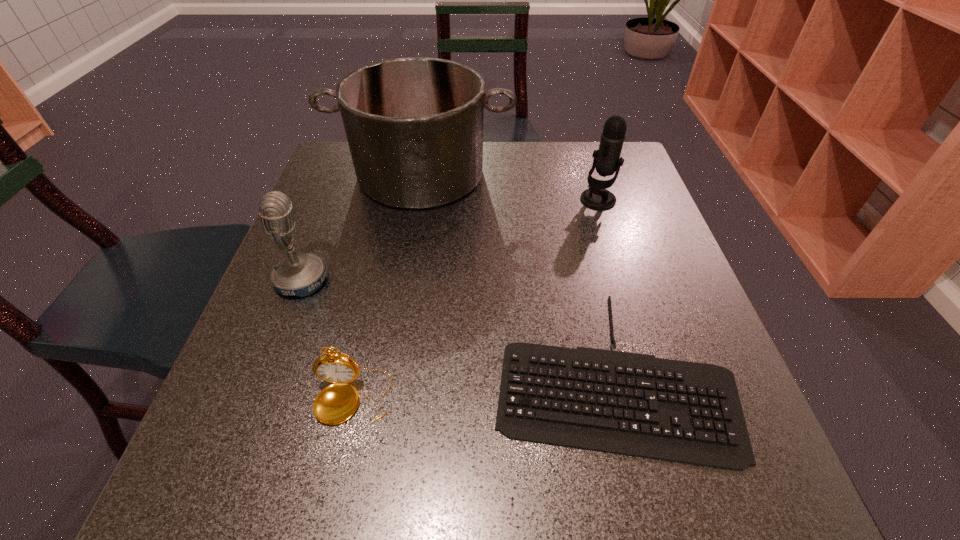
Where is `pan`? The width and height of the screenshot is (960, 540). pan is located at coordinates (414, 126).

In order to click on the farther microphone in this screenshot , I will do `click(607, 160)`.

The height and width of the screenshot is (540, 960). What are the coordinates of `the nearer microphone` in the screenshot? It's located at (302, 274).

I want to click on the fourth tallest object, so click(x=336, y=403).

Find the location of a particular element. The width and height of the screenshot is (960, 540). the shortest object is located at coordinates (634, 404).

Locate an element on the screen. vacant area situated on the front of the pan is located at coordinates (404, 276).

This screenshot has height=540, width=960. I want to click on free spot located 0.080m on the front of the right microphone, so click(609, 232).

The height and width of the screenshot is (540, 960). I want to click on vacant space located on the front-facing side of the nearer microphone, so coord(481,280).

This screenshot has width=960, height=540. What are the coordinates of `free spot located 0.110m on the face of the pocket watch` in the screenshot? It's located at (330, 503).

Image resolution: width=960 pixels, height=540 pixels. I want to click on free region located on the left of the shortest object, so click(270, 371).